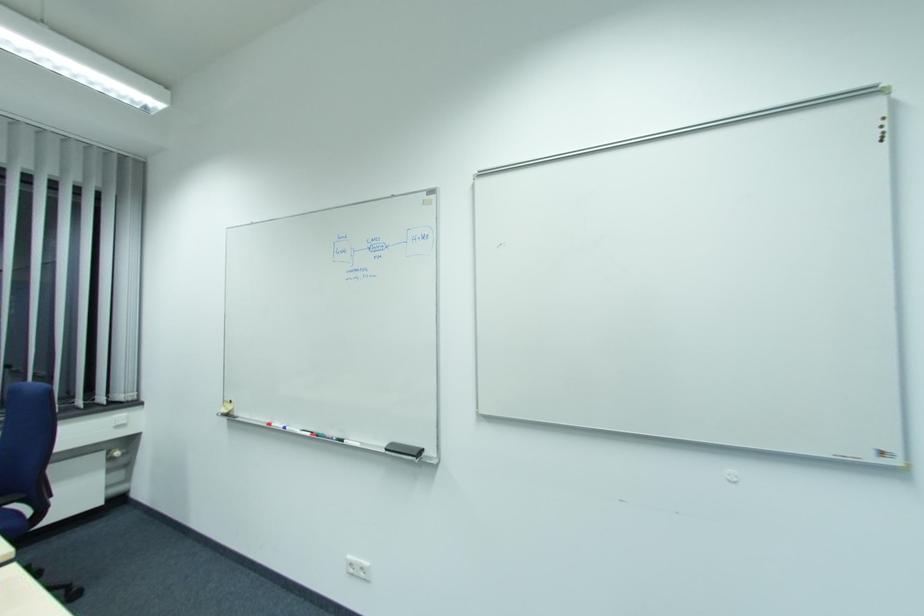
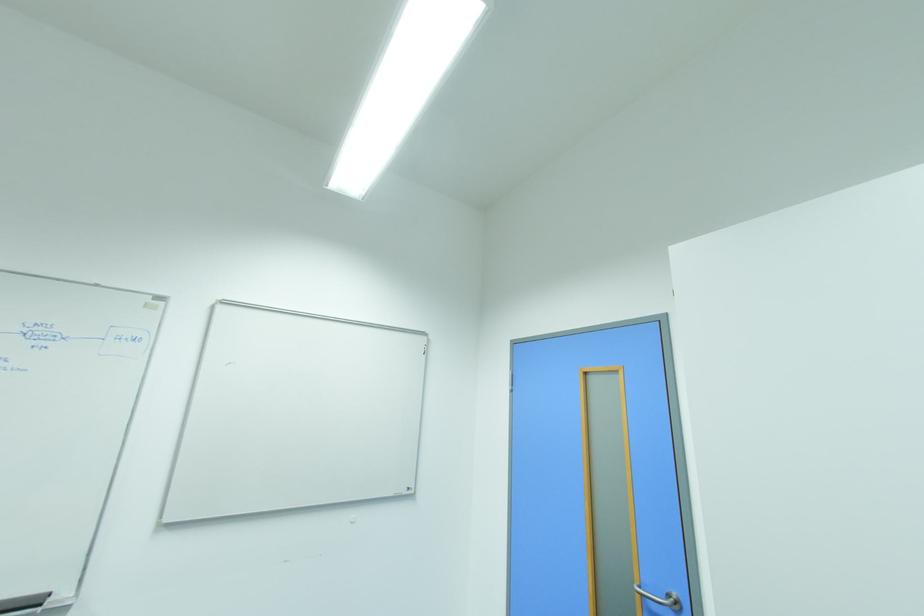
Question: Based on the continuous images, in which direction is the camera rotating? Reply with the corresponding letter.

Choices:
 (A) Left
 (B) Right
 (C) Up
 (D) Down

Answer: (B)